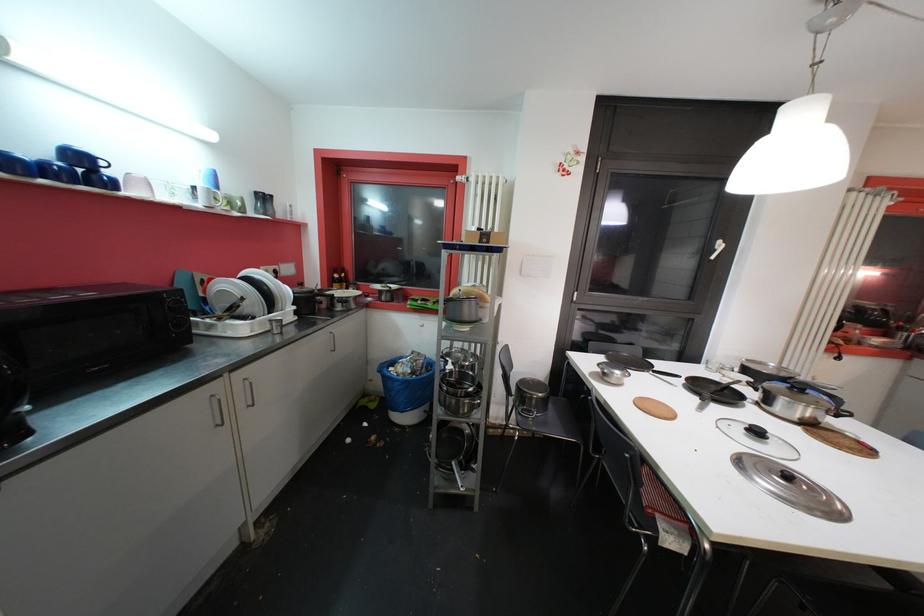
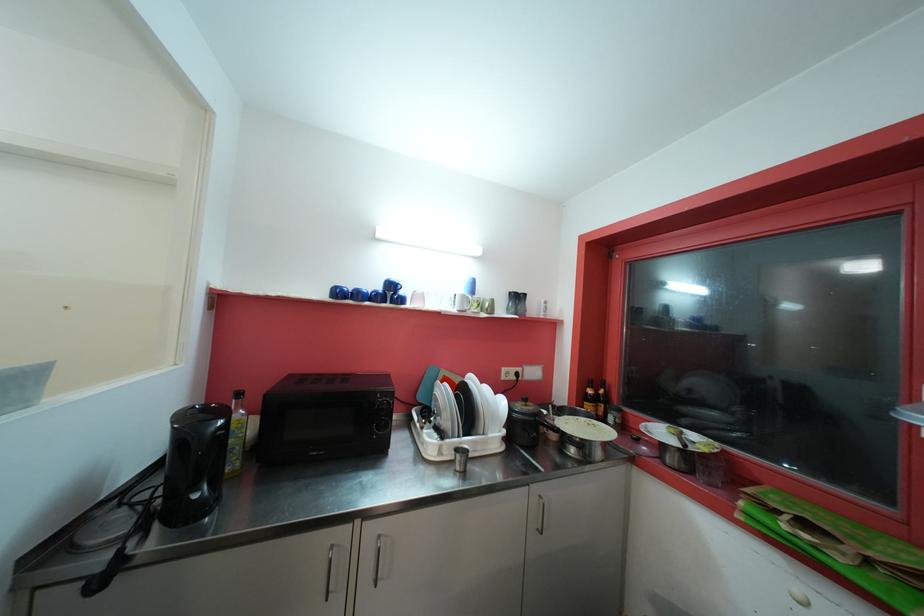
Question: How did the camera likely rotate?

Choices:
 (A) Left
 (B) Right
 (C) Up
 (D) Down

Answer: (A)